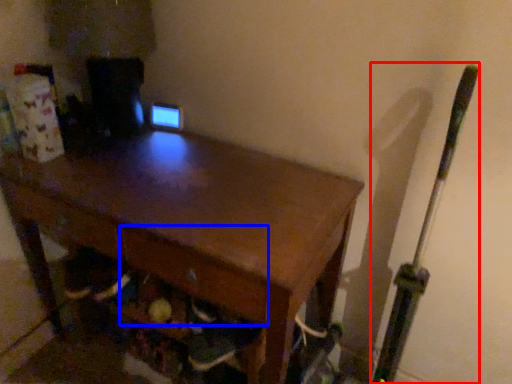
Question: Among these objects, which one is farthest to the camera, baseball bat (highlighted by a red box) or drawer (highlighted by a blue box)?

Choices:
 (A) baseball bat
 (B) drawer

Answer: (B)